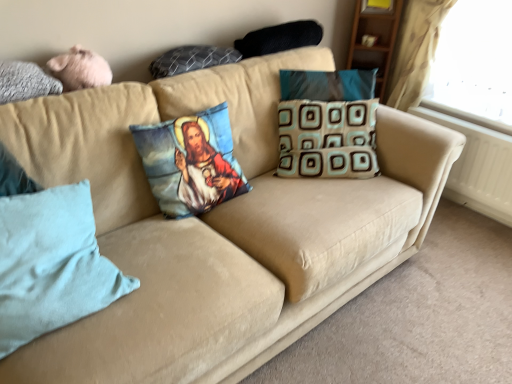
Question: Can you confirm if light blue fabric pillow at lower left, the 6th pillow viewed from the top, is bigger than gray textured pillow at upper left, which is the 4th pillow from bottom to top?

Choices:
 (A) yes
 (B) no

Answer: (A)

Question: Does light blue fabric pillow at lower left, which is the 1th pillow in bottom-to-top order, have a lesser height compared to gray textured pillow at upper left, which is the 4th pillow from bottom to top?

Choices:
 (A) no
 (B) yes

Answer: (A)

Question: Does light blue fabric pillow at lower left, which is the 1th pillow in bottom-to-top order, have a smaller size compared to gray textured pillow at upper left, which is the 3th pillow from top to bottom?

Choices:
 (A) no
 (B) yes

Answer: (A)

Question: From the image's perspective, is light blue fabric pillow at lower left, which is the 1th pillow in bottom-to-top order, over gray textured pillow at upper left, which is the 4th pillow from bottom to top?

Choices:
 (A) no
 (B) yes

Answer: (A)

Question: From a real-world perspective, is light blue fabric pillow at lower left, the 6th pillow viewed from the top, on top of gray textured pillow at upper left, which is the 3th pillow from top to bottom?

Choices:
 (A) yes
 (B) no

Answer: (B)

Question: Considering their positions, is white plastic radiator at lower right located in front of or behind light blue fabric pillow at lower left, the 6th pillow viewed from the top?

Choices:
 (A) behind
 (B) front

Answer: (A)

Question: Does point (479, 198) appear closer or farther from the camera than point (7, 327)?

Choices:
 (A) farther
 (B) closer

Answer: (A)

Question: Is white plastic radiator at lower right situated inside light blue fabric pillow at lower left, the 6th pillow viewed from the top, or outside?

Choices:
 (A) inside
 (B) outside

Answer: (B)

Question: In terms of width, does white plastic radiator at lower right look wider or thinner when compared to light blue fabric pillow at lower left, the 6th pillow viewed from the top?

Choices:
 (A) wide
 (B) thin

Answer: (B)

Question: Is point (27, 89) closer or farther from the camera than point (210, 49)?

Choices:
 (A) closer
 (B) farther

Answer: (A)

Question: Would you say gray textured pillow at upper left, which is the 3th pillow from top to bottom, is inside or outside textured gray pillow at upper center, which appears as the 5th pillow when ordered from the bottom?

Choices:
 (A) outside
 (B) inside

Answer: (A)

Question: In the image, is gray textured pillow at upper left, which is the 4th pillow from bottom to top, positioned in front of or behind textured gray pillow at upper center, which is the second pillow in top-to-bottom order?

Choices:
 (A) front
 (B) behind

Answer: (A)

Question: In terms of width, does gray textured pillow at upper left, which is the 3th pillow from top to bottom, look wider or thinner when compared to textured gray pillow at upper center, which is the second pillow in top-to-bottom order?

Choices:
 (A) thin
 (B) wide

Answer: (B)

Question: In terms of height, does black textured pillow at upper center, the sixth pillow positioned from the bottom, look taller or shorter compared to textured gray pillow at upper center, which is the second pillow in top-to-bottom order?

Choices:
 (A) tall
 (B) short

Answer: (A)

Question: From the image's perspective, relative to textured gray pillow at upper center, which is the second pillow in top-to-bottom order, is black textured pillow at upper center, the sixth pillow positioned from the bottom, above or below?

Choices:
 (A) below
 (B) above

Answer: (B)